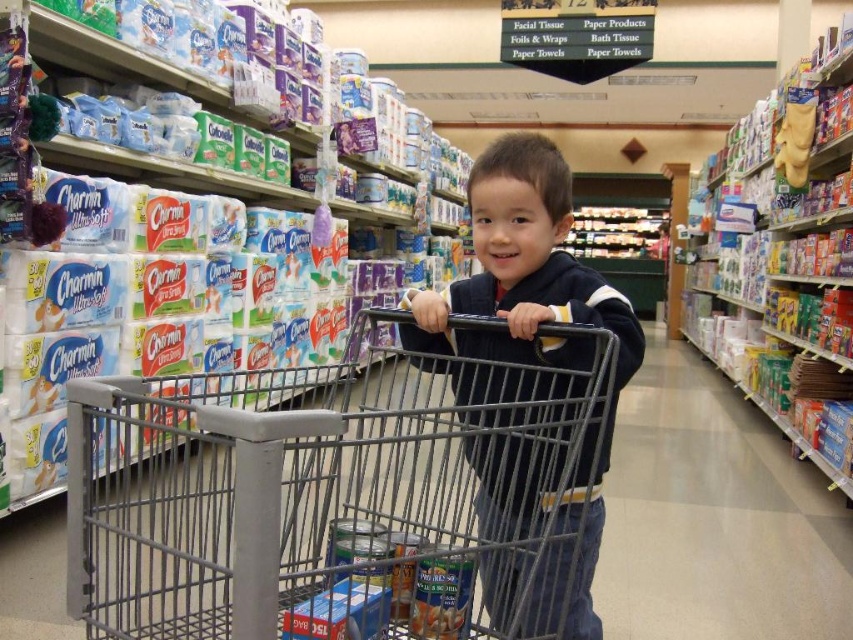
Can you confirm if metallic gray shopping cart at center is wider than dark blue sweater at center?

Indeed, metallic gray shopping cart at center has a greater width compared to dark blue sweater at center.

Which is above, metallic gray shopping cart at center or dark blue sweater at center?

dark blue sweater at center is higher up.

Describe the element at coordinates (332, 492) in the screenshot. This screenshot has width=853, height=640. I see `metallic gray shopping cart at center` at that location.

Where is `metallic gray shopping cart at center`? Image resolution: width=853 pixels, height=640 pixels. metallic gray shopping cart at center is located at coordinates (332, 492).